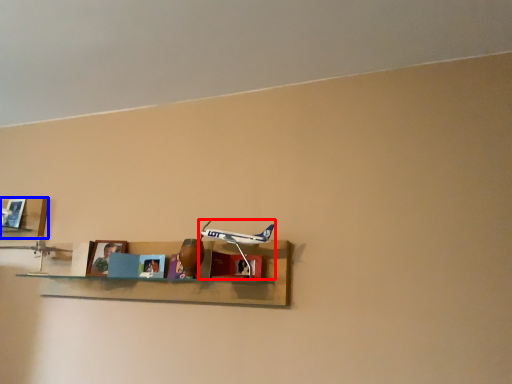
Question: Which object is further to the camera taking this photo, toy (highlighted by a red box) or shelf (highlighted by a blue box)?

Choices:
 (A) toy
 (B) shelf

Answer: (B)